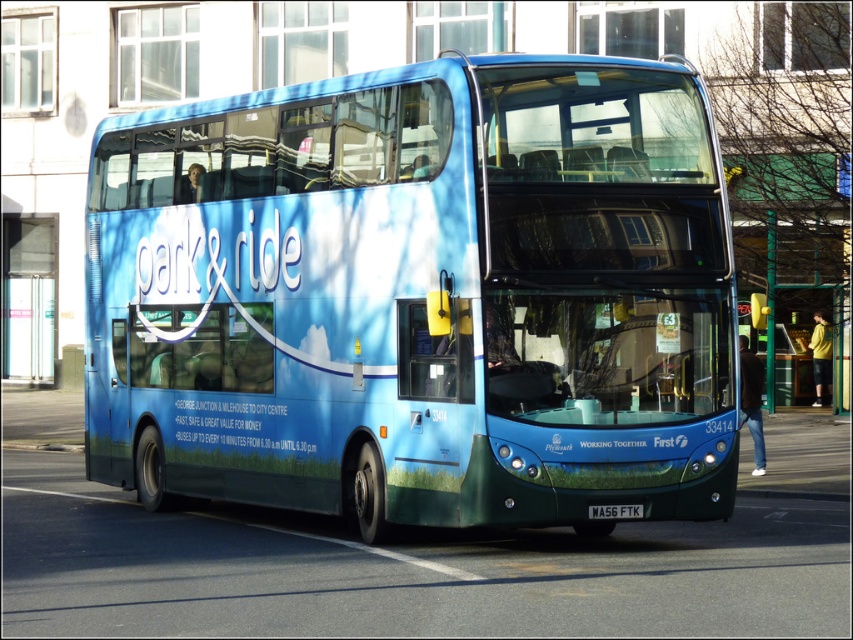
Question: Is blue metallic bus at center bigger than black plastic license plate at center?

Choices:
 (A) no
 (B) yes

Answer: (B)

Question: Does blue metallic bus at center appear over black plastic license plate at center?

Choices:
 (A) yes
 (B) no

Answer: (A)

Question: Which point is farther to the camera?

Choices:
 (A) (590, 515)
 (B) (734, 376)

Answer: (B)

Question: Can you confirm if blue metallic bus at center is wider than black plastic license plate at center?

Choices:
 (A) yes
 (B) no

Answer: (A)

Question: Among these objects, which one is farthest from the camera?

Choices:
 (A) blue metallic bus at center
 (B) black plastic license plate at center

Answer: (B)

Question: Which of the following is the closest to the observer?

Choices:
 (A) pos(445,209)
 (B) pos(619,509)

Answer: (A)